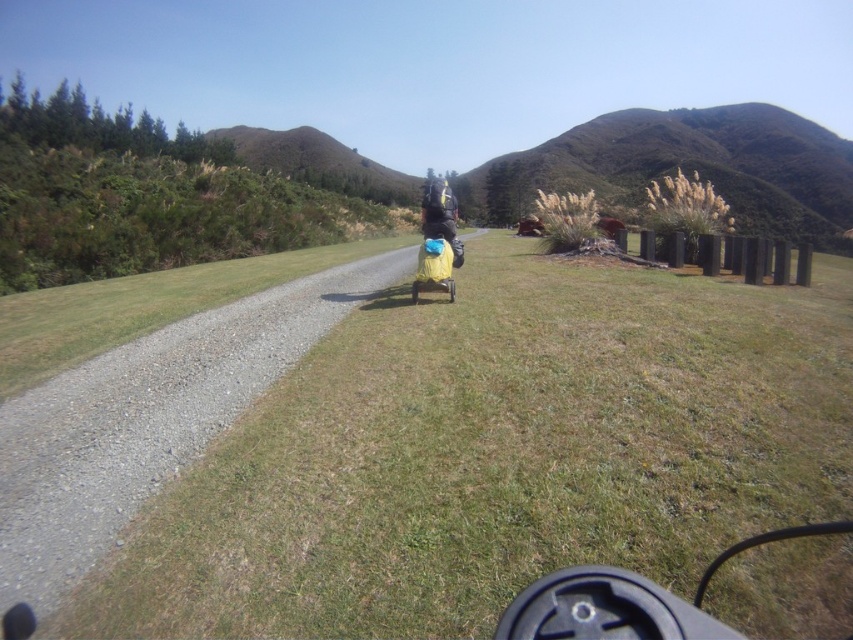
Which is behind, point (720, 310) or point (421, 211)?

Positioned behind is point (421, 211).

Between green grassy at center and matte black backpack at center, which one has less height?

Standing shorter between the two is green grassy at center.

Where is `green grassy at center`? The width and height of the screenshot is (853, 640). green grassy at center is located at coordinates (497, 452).

The image size is (853, 640). What are the coordinates of `green grassy at center` in the screenshot? It's located at (497, 452).